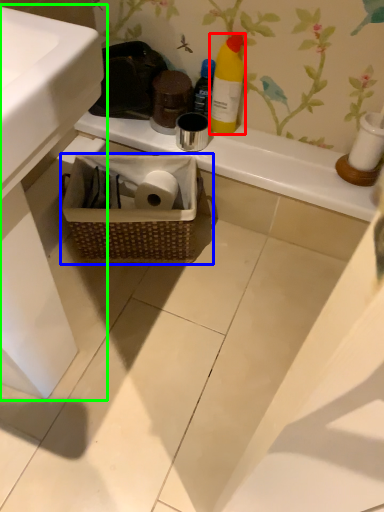
Question: Which object is the closest to the bottle (highlighted by a red box)? Choose among these: picnic basket (highlighted by a blue box) or sink (highlighted by a green box).

Choices:
 (A) picnic basket
 (B) sink

Answer: (A)